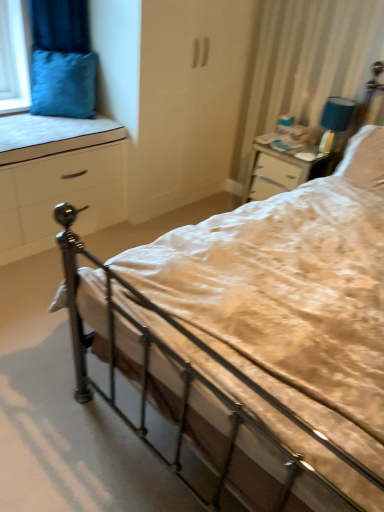
Question: From a real-world perspective, does white fabric mattress at left stand above blue fabric lampshade at upper right?

Choices:
 (A) yes
 (B) no

Answer: (B)

Question: Does white fabric mattress at left contain blue fabric lampshade at upper right?

Choices:
 (A) yes
 (B) no

Answer: (B)

Question: Considering the relative sizes of white fabric mattress at left and blue fabric lampshade at upper right in the image provided, is white fabric mattress at left wider than blue fabric lampshade at upper right?

Choices:
 (A) yes
 (B) no

Answer: (A)

Question: Does white fabric mattress at left have a greater height compared to blue fabric lampshade at upper right?

Choices:
 (A) yes
 (B) no

Answer: (B)

Question: Is white fabric mattress at left to the left of blue fabric lampshade at upper right from the viewer's perspective?

Choices:
 (A) no
 (B) yes

Answer: (B)

Question: Considering the positions of point (327, 129) and point (43, 140), is point (327, 129) closer or farther from the camera than point (43, 140)?

Choices:
 (A) farther
 (B) closer

Answer: (A)

Question: In the image, is blue fabric lampshade at upper right positioned in front of or behind white fabric mattress at left?

Choices:
 (A) behind
 (B) front

Answer: (A)

Question: Is blue fabric lampshade at upper right inside the boundaries of white fabric mattress at left, or outside?

Choices:
 (A) outside
 (B) inside

Answer: (A)

Question: Is blue fabric lampshade at upper right bigger or smaller than white fabric mattress at left?

Choices:
 (A) small
 (B) big

Answer: (A)

Question: From a real-world perspective, is blue fabric lampshade at upper right positioned above or below velvety blue pillow at upper left, which is counted as the 1th pillow, starting from the left?

Choices:
 (A) below
 (B) above

Answer: (A)

Question: From the image's perspective, relative to velvety blue pillow at upper left, which is the second pillow in right-to-left order, is blue fabric lampshade at upper right above or below?

Choices:
 (A) below
 (B) above

Answer: (A)

Question: Is blue fabric lampshade at upper right taller or shorter than velvety blue pillow at upper left, which is the second pillow in right-to-left order?

Choices:
 (A) tall
 (B) short

Answer: (B)

Question: Considering their positions, is blue fabric lampshade at upper right located in front of or behind velvety blue pillow at upper left, which is counted as the 1th pillow, starting from the left?

Choices:
 (A) behind
 (B) front

Answer: (A)

Question: From their relative heights in the image, would you say white matte chest of drawers at left is taller or shorter than velvety blue pillow at upper left, which is the second pillow in right-to-left order?

Choices:
 (A) short
 (B) tall

Answer: (B)

Question: From a real-world perspective, is white matte chest of drawers at left physically located above or below velvety blue pillow at upper left, which is the second pillow in right-to-left order?

Choices:
 (A) below
 (B) above

Answer: (A)